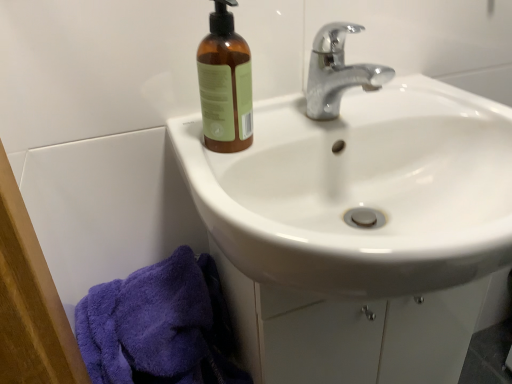
Question: Considering the relative sizes of brown glass bottle at upper left and chrome metallic faucet at upper center in the image provided, is brown glass bottle at upper left smaller than chrome metallic faucet at upper center?

Choices:
 (A) yes
 (B) no

Answer: (A)

Question: Does brown glass bottle at upper left have a lesser height compared to chrome metallic faucet at upper center?

Choices:
 (A) yes
 (B) no

Answer: (B)

Question: From the image's perspective, is brown glass bottle at upper left on chrome metallic faucet at upper center?

Choices:
 (A) no
 (B) yes

Answer: (A)

Question: Is brown glass bottle at upper left not inside chrome metallic faucet at upper center?

Choices:
 (A) yes
 (B) no

Answer: (A)

Question: From a real-world perspective, is brown glass bottle at upper left under chrome metallic faucet at upper center?

Choices:
 (A) yes
 (B) no

Answer: (B)

Question: Are brown glass bottle at upper left and chrome metallic faucet at upper center beside each other?

Choices:
 (A) no
 (B) yes

Answer: (A)

Question: From a real-world perspective, is brown glass bottle at upper left physically above white glossy sink at upper center?

Choices:
 (A) no
 (B) yes

Answer: (B)

Question: Is brown glass bottle at upper left shorter than white glossy sink at upper center?

Choices:
 (A) no
 (B) yes

Answer: (A)

Question: Is brown glass bottle at upper left positioned before white glossy sink at upper center?

Choices:
 (A) no
 (B) yes

Answer: (A)

Question: Considering the relative sizes of brown glass bottle at upper left and white glossy sink at upper center in the image provided, is brown glass bottle at upper left bigger than white glossy sink at upper center?

Choices:
 (A) no
 (B) yes

Answer: (A)

Question: Does brown glass bottle at upper left have a smaller size compared to white glossy sink at upper center?

Choices:
 (A) yes
 (B) no

Answer: (A)

Question: Is brown glass bottle at upper left facing towards white glossy sink at upper center?

Choices:
 (A) yes
 (B) no

Answer: (B)

Question: Is white glossy sink at upper center thinner than brown glass bottle at upper left?

Choices:
 (A) yes
 (B) no

Answer: (B)